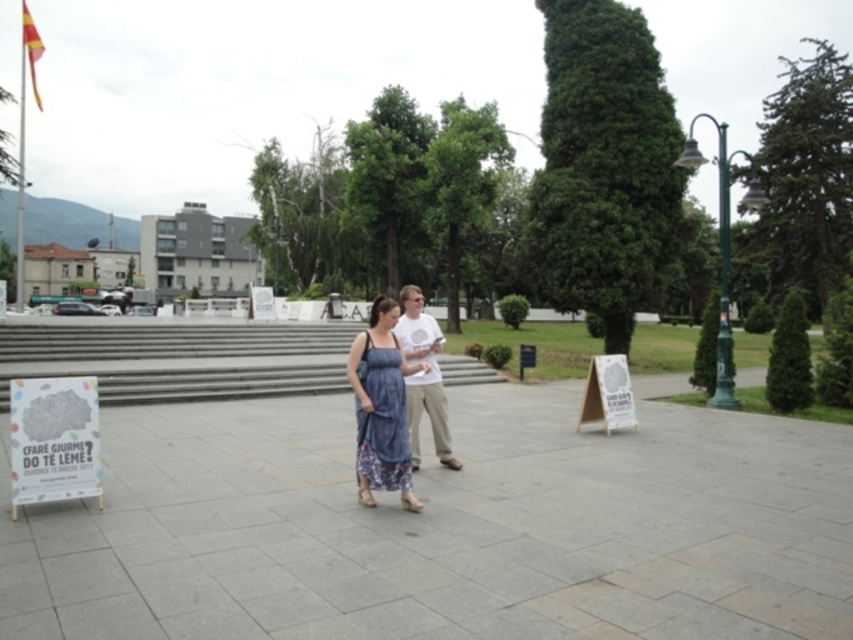
You are a photographer at the park and want to capture both the denim dress at center and the dusty blue floral dress at center in a single shot. Which dress should you position closer to the left side of the camera frame to ensure both are visible?

The denim dress at center is already positioned on the left side of the dusty blue floral dress at center, so you should keep the denim dress at center closer to the left side of the camera frame to ensure both are visible.